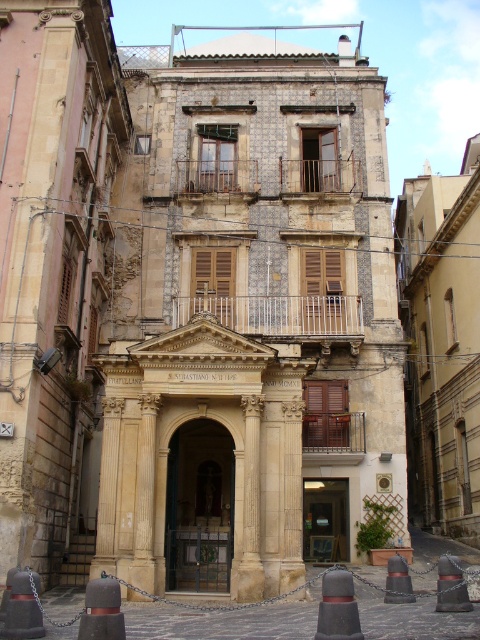
Question: Among these objects, which one is nearest to the camera?

Choices:
 (A) smooth stone archway at center
 (B) matte glass door at center
 (C) smooth black cone at lower center

Answer: (C)

Question: Which is nearer to the white metal balcony at center?

Choices:
 (A) smooth stone archway at center
 (B) smooth stone column at center
 (C) wooden railing balcony at center
 (D) matte glass door at center

Answer: (C)

Question: Can you confirm if white metal balcony at center is wider than wooden balcony at center?

Choices:
 (A) yes
 (B) no

Answer: (A)

Question: Can you confirm if white metal balcony at center is positioned to the right of smooth stone column at center?

Choices:
 (A) no
 (B) yes

Answer: (B)

Question: Does rustic wood balcony at upper center have a larger size compared to black rubber traffic cone at lower left?

Choices:
 (A) yes
 (B) no

Answer: (A)

Question: Which object is farther from the camera taking this photo?

Choices:
 (A) white metal balcony at center
 (B) black rubber traffic cone at lower left
 (C) smooth stone column at center

Answer: (A)